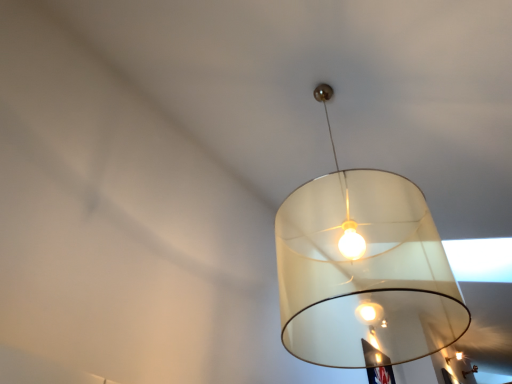
Question: Considering the relative sizes of matte white lampshade at center, marked as the 2th lamp in a front-to-back arrangement, and matte white lampshade at center, the 3th lamp positioned from the top, in the image provided, is matte white lampshade at center, marked as the 2th lamp in a front-to-back arrangement, smaller than matte white lampshade at center, the 3th lamp positioned from the top,?

Choices:
 (A) no
 (B) yes

Answer: (A)

Question: Does matte white lampshade at center, the second lamp ordered from the bottom, appear on the left side of matte white lampshade at center, which appears as the third lamp when viewed from the front?

Choices:
 (A) yes
 (B) no

Answer: (A)

Question: Could matte white lampshade at center, which appears as the first lamp when viewed from the right, be considered to be inside matte white lampshade at center, marked as the 2th lamp in a front-to-back arrangement?

Choices:
 (A) yes
 (B) no

Answer: (B)

Question: Does matte white lampshade at center, placed as the second lamp when sorted from back to front, turn towards matte white lampshade at center, which appears as the first lamp when viewed from the right?

Choices:
 (A) no
 (B) yes

Answer: (A)

Question: Does matte white lampshade at center, which is the second lamp in left-to-right order, have a greater height compared to matte white lampshade at center, which appears as the first lamp when viewed from the right?

Choices:
 (A) no
 (B) yes

Answer: (B)

Question: Considering the positions of point (463, 374) and point (448, 362), is point (463, 374) closer or farther from the camera than point (448, 362)?

Choices:
 (A) farther
 (B) closer

Answer: (A)

Question: From a real-world perspective, is matte white lampshade at center, the 3th lamp positioned from the top, positioned above or below matte white lampshade at center, acting as the 2th lamp starting from the top?

Choices:
 (A) below
 (B) above

Answer: (B)

Question: Is matte white lampshade at center, which appears as the third lamp when viewed from the front, to the left or to the right of matte white lampshade at center, acting as the 2th lamp starting from the top, in the image?

Choices:
 (A) left
 (B) right

Answer: (B)

Question: Based on their sizes in the image, would you say matte white lampshade at center, which appears as the third lamp when viewed from the front, is bigger or smaller than matte white lampshade at center, which is the second lamp in left-to-right order?

Choices:
 (A) small
 (B) big

Answer: (A)

Question: In terms of size, does matte white lampshade at center, the second lamp when ordered from right to left, appear bigger or smaller than translucent white lampshade at upper center, arranged as the 3th lamp when ordered from the bottom?

Choices:
 (A) big
 (B) small

Answer: (B)

Question: Do you think matte white lampshade at center, the second lamp when ordered from right to left, is within translucent white lampshade at upper center, which ranks as the third lamp in back-to-front order, or outside of it?

Choices:
 (A) inside
 (B) outside

Answer: (B)

Question: Considering the positions of point (459, 352) and point (370, 327), is point (459, 352) closer or farther from the camera than point (370, 327)?

Choices:
 (A) farther
 (B) closer

Answer: (B)

Question: Considering the positions of matte white lampshade at center, the second lamp ordered from the bottom, and translucent white lampshade at upper center, which appears as the 1th lamp when viewed from the front, in the image, is matte white lampshade at center, the second lamp ordered from the bottom, taller or shorter than translucent white lampshade at upper center, which appears as the 1th lamp when viewed from the front,?

Choices:
 (A) short
 (B) tall

Answer: (A)

Question: Considering the positions of translucent white lampshade at upper center, positioned as the first lamp in top-to-bottom order, and matte white lampshade at center, the 3th lamp positioned from the top, in the image, is translucent white lampshade at upper center, positioned as the first lamp in top-to-bottom order, taller or shorter than matte white lampshade at center, the 3th lamp positioned from the top,?

Choices:
 (A) short
 (B) tall

Answer: (B)

Question: Is translucent white lampshade at upper center, which ranks as the third lamp in back-to-front order, spatially inside matte white lampshade at center, which appears as the first lamp when viewed from the right, or outside of it?

Choices:
 (A) outside
 (B) inside

Answer: (A)